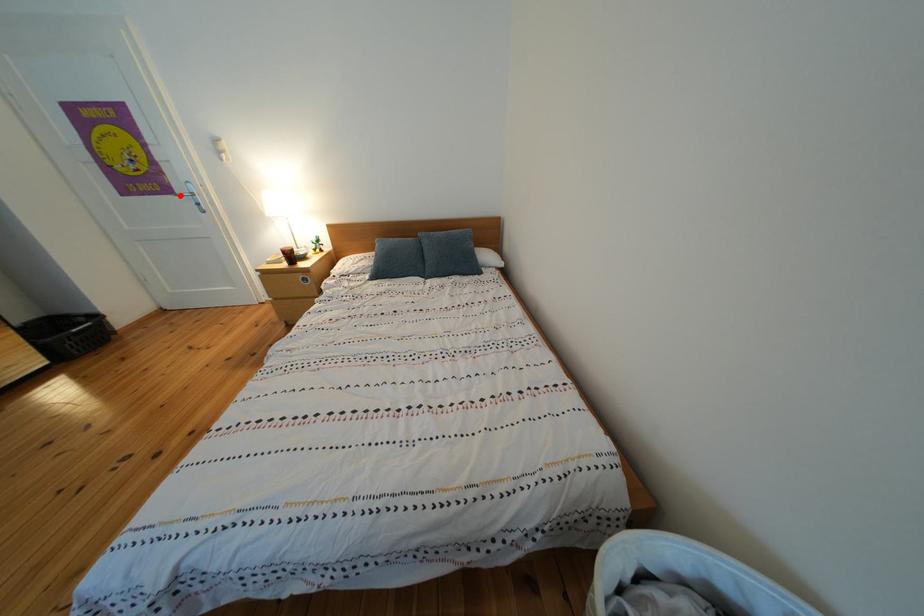
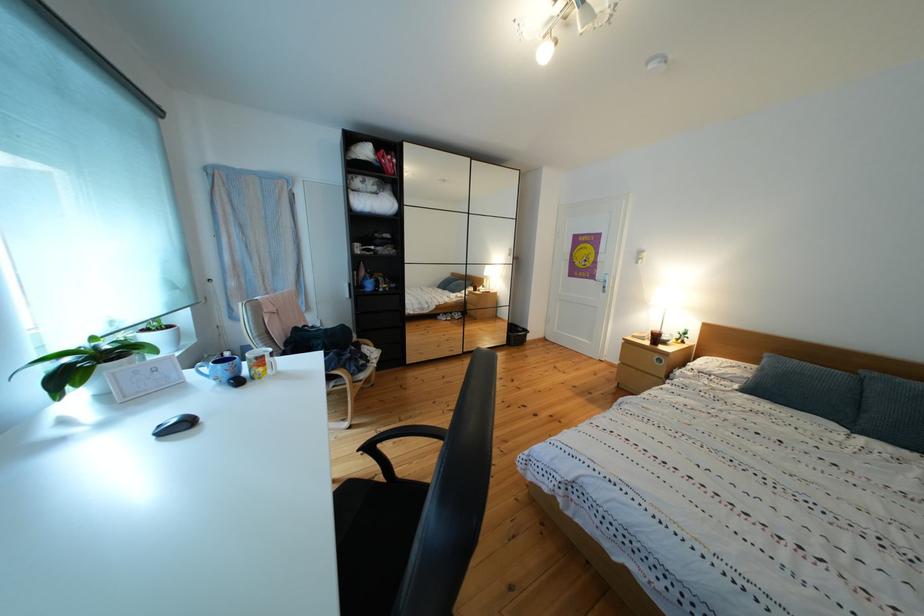
In the second image, find the point that corresponds to the highlighted location in the first image.

(603, 283)